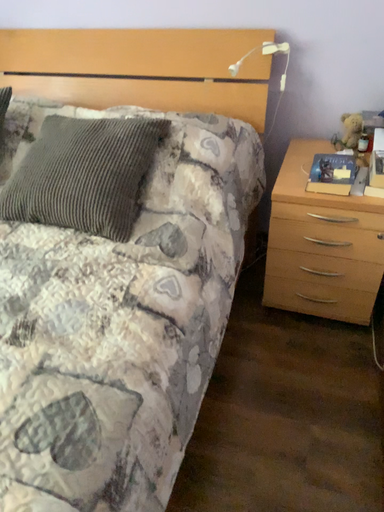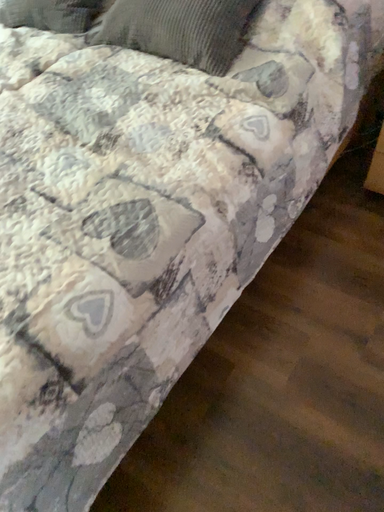
Question: Which way did the camera rotate in the video?

Choices:
 (A) rotated downward
 (B) rotated upward

Answer: (A)